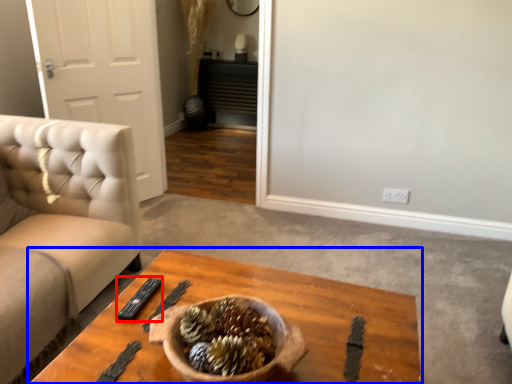
Question: Which object appears farthest to the camera in this image, remote (highlighted by a red box) or coffee table (highlighted by a blue box)?

Choices:
 (A) remote
 (B) coffee table

Answer: (A)